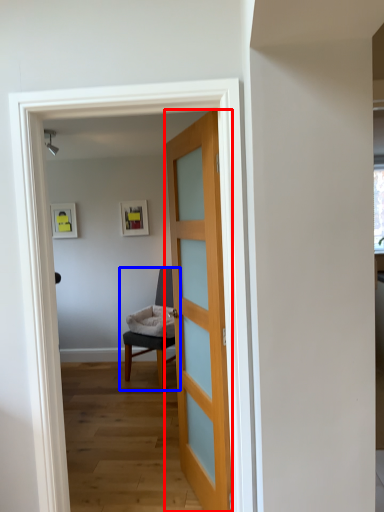
Question: Among these objects, which one is farthest to the camera, door (highlighted by a red box) or chair (highlighted by a blue box)?

Choices:
 (A) door
 (B) chair

Answer: (B)